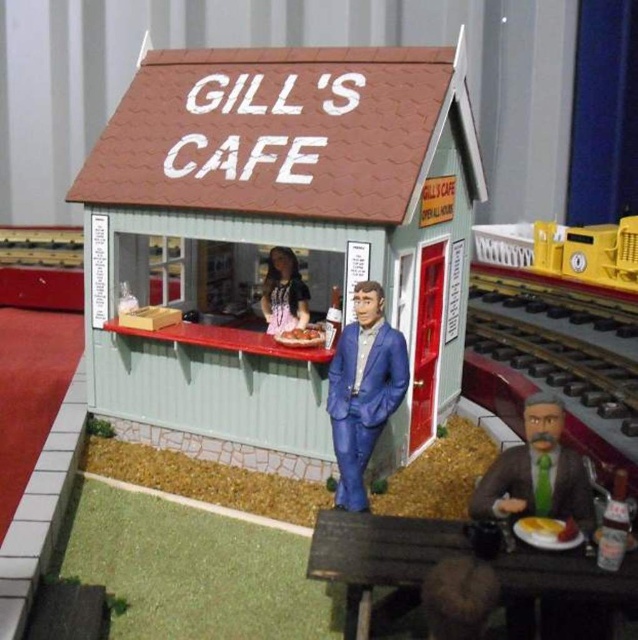
Between green corrugated metal hut at center and yellow plastic train at right, which one has less height?

yellow plastic train at right

The height and width of the screenshot is (640, 638). What do you see at coordinates (281, 230) in the screenshot?
I see `green corrugated metal hut at center` at bounding box center [281, 230].

This screenshot has width=638, height=640. What are the coordinates of `green corrugated metal hut at center` in the screenshot? It's located at (281, 230).

Does green corrugated metal hut at center appear over matte black dress at center?

Yes.

Image resolution: width=638 pixels, height=640 pixels. What are the coordinates of `green corrugated metal hut at center` in the screenshot? It's located at (281, 230).

Which is behind, point (521, 483) or point (295, 268)?

The point (295, 268) is behind.

You are a GUI agent. You are given a task and a screenshot of the screen. Output one action in this format:
    pyautogui.click(x=<x>, y=<y>)
    Task: Click on the green fabric suit at lower right
    This screenshot has height=640, width=638.
    Given the screenshot: What is the action you would take?
    pyautogui.click(x=537, y=474)